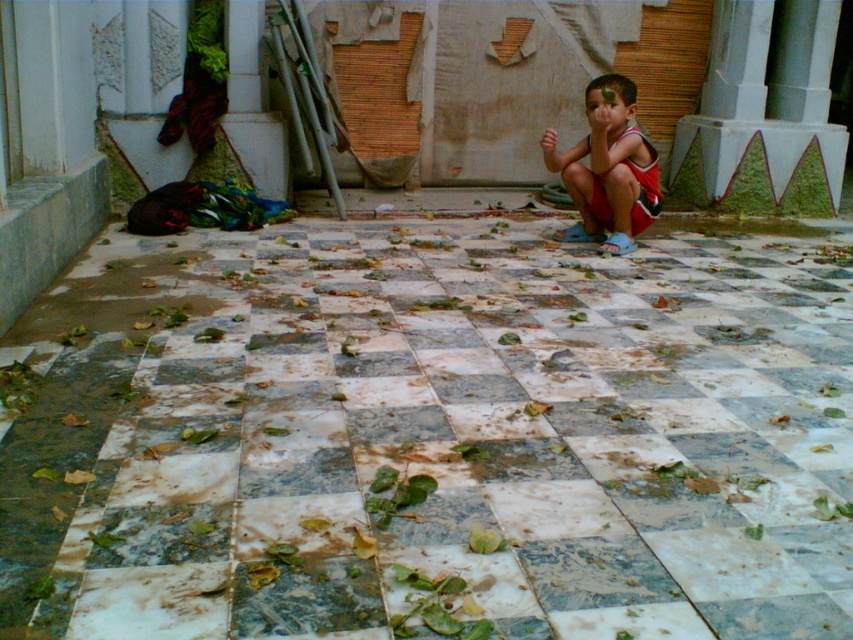
Measure the distance between marble tile at center and reddish-brown fabric shorts at center.

They are 4.27 feet apart.

Does point (527, 316) come in front of point (630, 243)?

Yes, point (527, 316) is in front of point (630, 243).

The image size is (853, 640). What do you see at coordinates (433, 436) in the screenshot?
I see `marble tile at center` at bounding box center [433, 436].

This screenshot has height=640, width=853. I want to click on marble tile at center, so click(x=433, y=436).